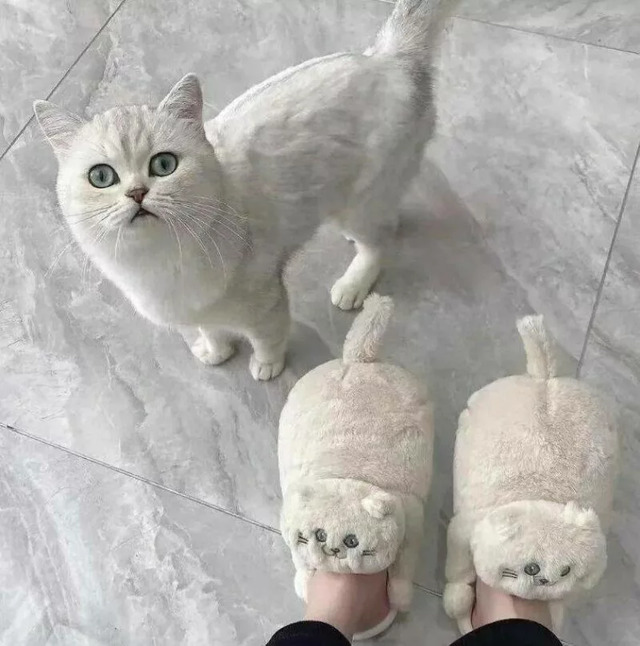
You are a GUI agent. You are given a task and a screenshot of the screen. Output one action in this format:
    pyautogui.click(x=<x>, y=<y>)
    Task: Click on the white kitten slippers
    The width and height of the screenshot is (640, 646).
    Given the screenshot: What is the action you would take?
    pyautogui.click(x=346, y=464), pyautogui.click(x=547, y=463)